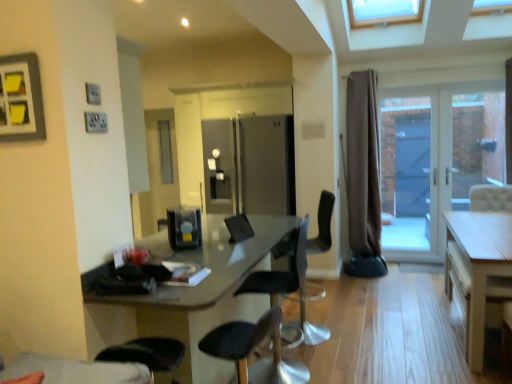
Question: From a real-world perspective, is matte gray picture frame at upper left physically above clear glass door at right?

Choices:
 (A) yes
 (B) no

Answer: (A)

Question: Is matte gray picture frame at upper left at the right side of clear glass door at right?

Choices:
 (A) no
 (B) yes

Answer: (A)

Question: Is matte gray picture frame at upper left surrounding clear glass door at right?

Choices:
 (A) no
 (B) yes

Answer: (A)

Question: Does matte gray picture frame at upper left turn towards clear glass door at right?

Choices:
 (A) yes
 (B) no

Answer: (B)

Question: Can you confirm if matte gray picture frame at upper left is thinner than clear glass door at right?

Choices:
 (A) no
 (B) yes

Answer: (B)

Question: In terms of height, does black plastic chair at center, marked as the 1th chair in a back-to-front arrangement, look taller or shorter compared to clear glass screen door at right?

Choices:
 (A) tall
 (B) short

Answer: (B)

Question: Does point (307, 299) appear closer or farther from the camera than point (394, 150)?

Choices:
 (A) closer
 (B) farther

Answer: (A)

Question: Considering the positions of black plastic chair at center, arranged as the third chair when viewed from the front, and clear glass screen door at right in the image, is black plastic chair at center, arranged as the third chair when viewed from the front, wider or thinner than clear glass screen door at right?

Choices:
 (A) thin
 (B) wide

Answer: (B)

Question: Is black plastic chair at center, arranged as the third chair when viewed from the front, situated inside clear glass screen door at right or outside?

Choices:
 (A) outside
 (B) inside

Answer: (A)

Question: Choose the correct answer: Is light wood table at right inside brown fabric curtain at right or outside it?

Choices:
 (A) outside
 (B) inside

Answer: (A)

Question: Is light wood table at right taller or shorter than brown fabric curtain at right?

Choices:
 (A) short
 (B) tall

Answer: (A)

Question: Is light wood table at right bigger or smaller than brown fabric curtain at right?

Choices:
 (A) small
 (B) big

Answer: (B)

Question: From a real-world perspective, is light wood table at right above or below brown fabric curtain at right?

Choices:
 (A) below
 (B) above

Answer: (A)

Question: In terms of height, does white glossy door at right look taller or shorter compared to light wood table at right?

Choices:
 (A) tall
 (B) short

Answer: (A)

Question: Looking at their shapes, would you say white glossy door at right is wider or thinner than light wood table at right?

Choices:
 (A) wide
 (B) thin

Answer: (B)